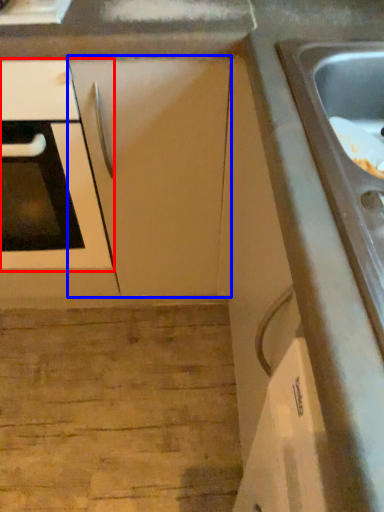
Question: Which point is closer to the camera, oven (highlighted by a red box) or cabinetry (highlighted by a blue box)?

Choices:
 (A) oven
 (B) cabinetry

Answer: (A)